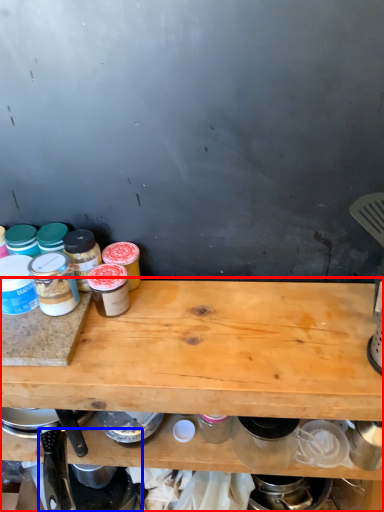
Question: Which of the following is the farthest to the observer, table (highlighted by a red box) or appliance (highlighted by a blue box)?

Choices:
 (A) table
 (B) appliance

Answer: (B)